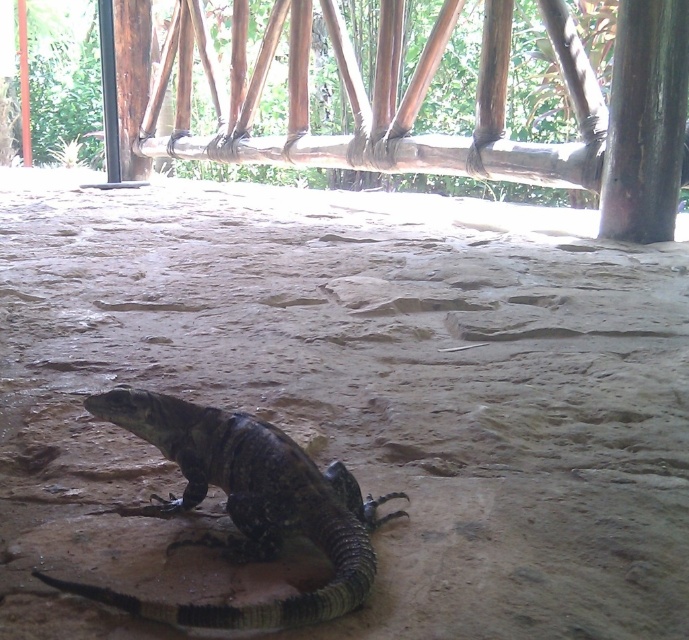
You are a researcher studying the lizard in its habitat. You need to place a temperature sensor on the ground directly below the wooden structure. The wooden structure is located at coordinates where the x and y values are both 0.5. Can you determine if the brown sandy ground at center is suitable for placing the sensor?

The brown sandy ground at center is located at point (349, 401), which is close to the wooden structure at (344, 320). Therefore, the brown sandy ground at center is suitable for placing the temperature sensor directly below the wooden structure.

You are a wildlife photographer aiming to capture the lizard without disturbing it. Since the brown sandy ground at center and the dark gray scaly lizard at center are both at the center, which one should you focus on to ensure the lizard is clearly visible?

The dark gray scaly lizard at center should be focused on because the brown sandy ground at center is larger in size, making the lizard stand out against the ground.

You are a small insect trying to cross from one side of the dark gray scaly lizard at center to the other. Can you fit between the lizard and the brown sandy ground at center if you are 2 cm wide?

A: The brown sandy ground at center might be wider than the dark gray scaly lizard at center, so it is possible that the space between them could accommodate a 2 cm wide insect. However, without exact measurements, this is an estimate based on the available information.